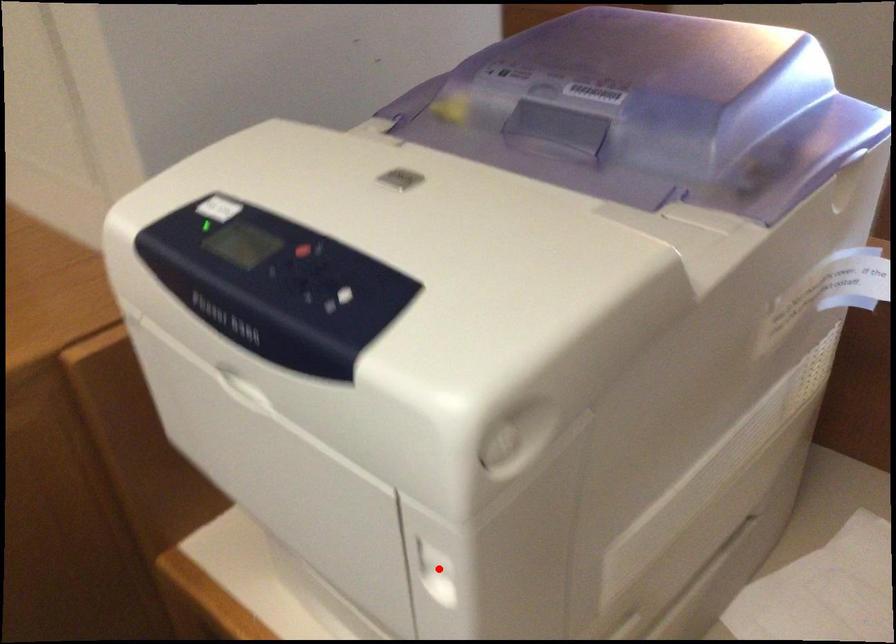
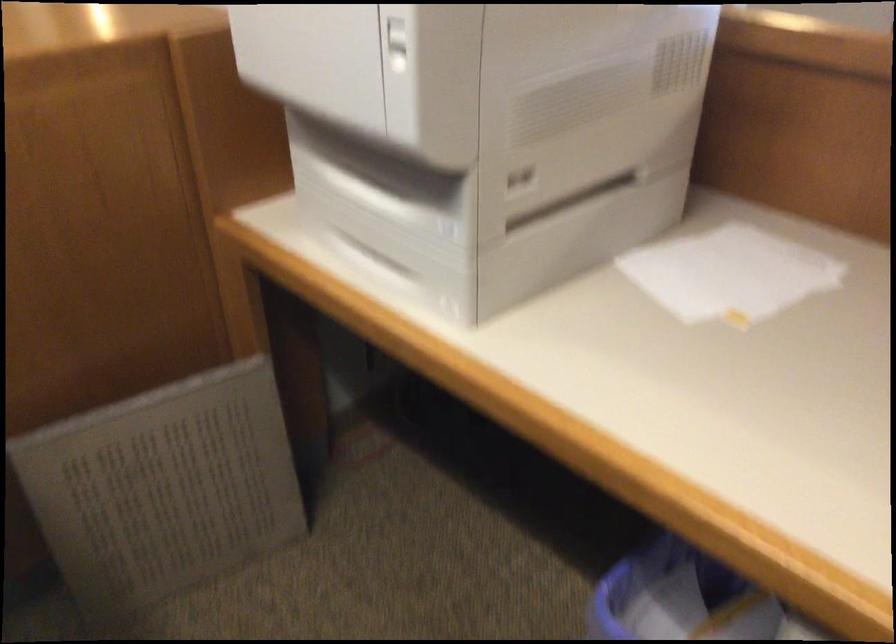
Question: I am providing you with two images of the same scene from different viewpoints. Given a red point in image1, look at the same physical point in image2. Is it:

Choices:
 (A) Closer to the viewpoint
 (B) Farther from the viewpoint

Answer: (B)